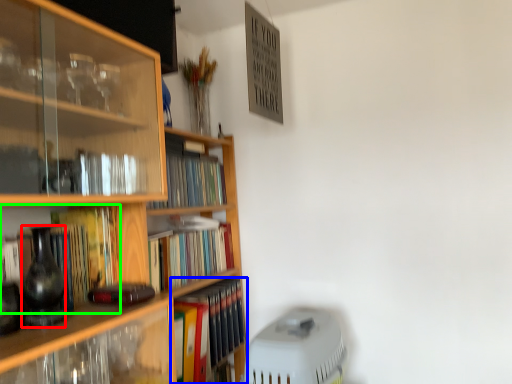
Question: Which object is the closest to the glass vase (highlighted by a red box)? Choose among these: book (highlighted by a blue box) or book (highlighted by a green box).

Choices:
 (A) book
 (B) book

Answer: (B)